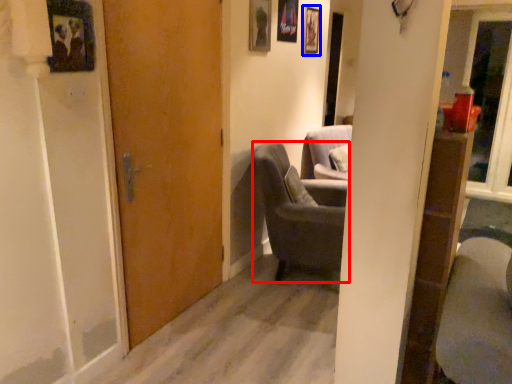
Question: Which of the following is the closest to the observer, chair (highlighted by a red box) or picture frame (highlighted by a blue box)?

Choices:
 (A) chair
 (B) picture frame

Answer: (A)